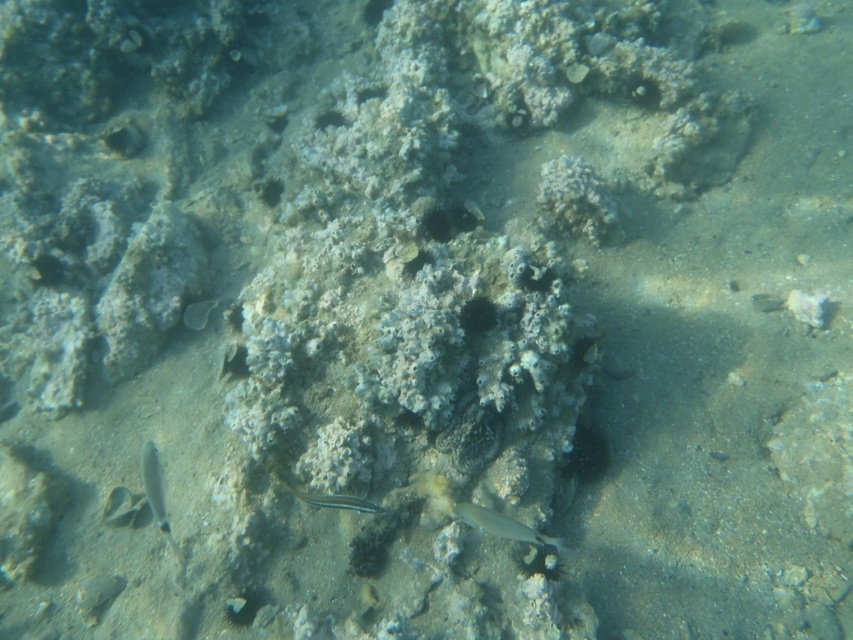
Find the location of a particular element. This screenshot has height=640, width=853. silvery metallic fish at center is located at coordinates (502, 525).

Consider the image. Can you confirm if silvery metallic fish at center is positioned below translucent silver fish at lower left?

Yes, silvery metallic fish at center is below translucent silver fish at lower left.

What do you see at coordinates (502, 525) in the screenshot? I see `silvery metallic fish at center` at bounding box center [502, 525].

What are the coordinates of `silvery metallic fish at center` in the screenshot? It's located at (502, 525).